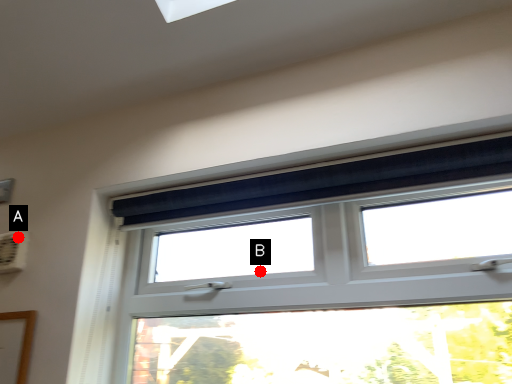
Question: Two points are circled on the image, labeled by A and B beside each circle. Which of the following is the farthest from the observer?

Choices:
 (A) A is further
 (B) B is further

Answer: (A)